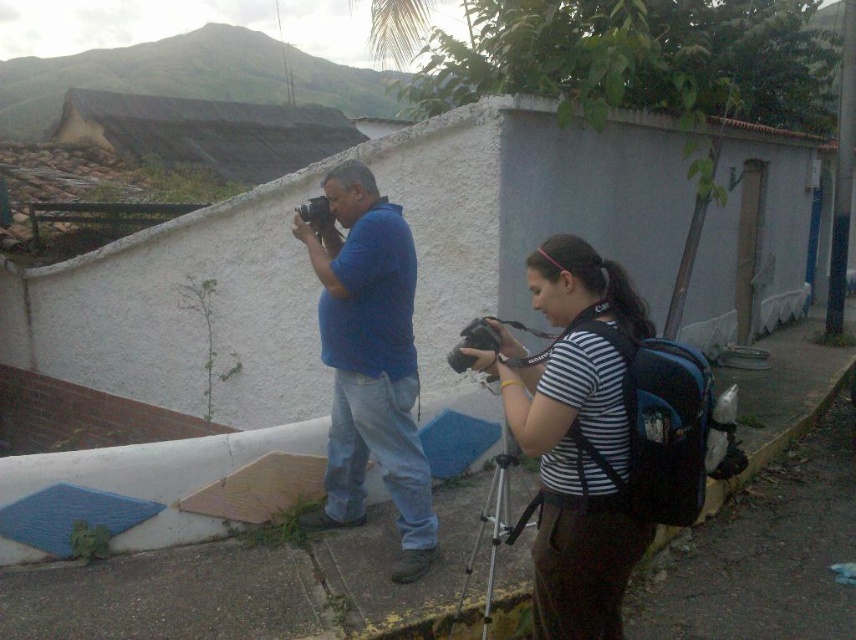
Question: Which object appears farthest from the camera in this image?

Choices:
 (A) black plastic camera at center
 (B) silver metallic tripod at lower center
 (C) blue cotton shirt at center
 (D) matte black camera at center

Answer: (A)

Question: In this image, where is silver metallic tripod at lower center located relative to black plastic camera at center?

Choices:
 (A) below
 (B) above

Answer: (A)

Question: Does blue cotton shirt at center have a lesser width compared to silver metallic tripod at lower center?

Choices:
 (A) yes
 (B) no

Answer: (B)

Question: Which point is farther from the camera taking this photo?

Choices:
 (A) 400,420
 (B) 305,202
 (C) 509,429

Answer: (B)

Question: Which of these objects is positioned closest to the striped fabric shirt at center?

Choices:
 (A) black plastic camera at center
 (B) blue cotton shirt at center

Answer: (B)

Question: In this image, where is silver metallic tripod at lower center located relative to black plastic camera at center?

Choices:
 (A) left
 (B) right

Answer: (B)